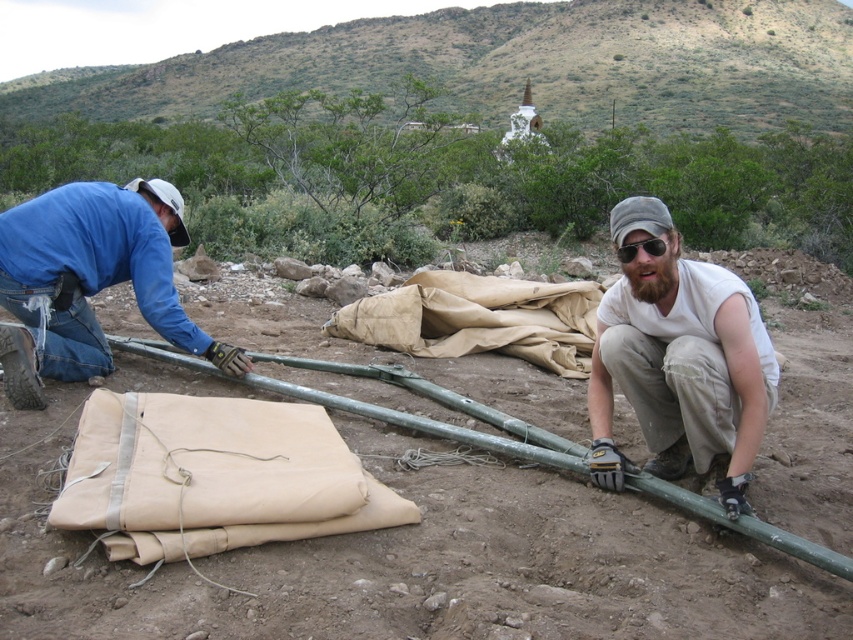
You are standing at the point marked by the coordinates point (676, 282). You want to walk towards the white stupa or monument in the background. Is there enough space between you and the monument to walk freely?

The point marked by the coordinates point (676, 282) is 10.99 feet away from the viewer. Since the terrain is rugged and arid with uneven ground, rocks, and sparse vegetation, there may be obstacles in the path towards the white stupa or monument. However, the distance itself allows for walking, but the actual navigability depends on the terrain conditions not specified in the provided information.

You are a drone operator tasked with capturing aerial footage of the white cotton shirt at center. The drone must hover at a safe distance to avoid disturbing the subject. Based on the coordinates provided, what is the recommended hover point for the drone?

The recommended hover point for the drone should be slightly above and to the side of the white cotton shirt at center, maintaining a safe distance while ensuring clear visibility. The exact coordinates would depend on the drone model and local regulations, but the shirt is located at point (x=677, y=358).